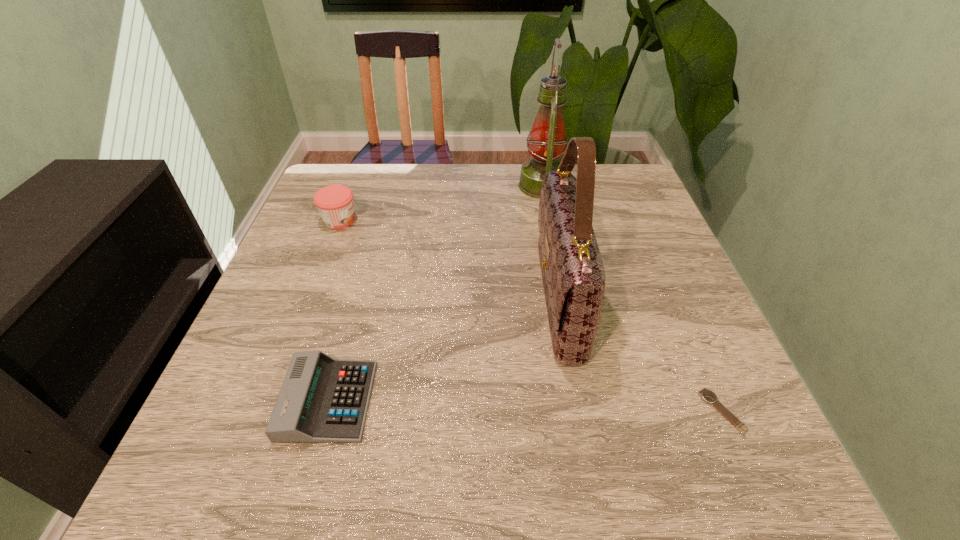
The image size is (960, 540). I want to click on object that is at the far left corner, so click(335, 204).

Locate an element on the screen. This screenshot has width=960, height=540. object present at the near left corner is located at coordinates (322, 400).

Identify the location of vacant space at the far edge of the desktop. This screenshot has height=540, width=960. (502, 169).

The image size is (960, 540). I want to click on vacant area at the left edge of the desktop, so click(x=349, y=259).

The width and height of the screenshot is (960, 540). In the image, there is a desktop. Identify the location of vacant space at the right edge. (628, 244).

I want to click on free space at the far left corner of the desktop, so click(x=357, y=180).

I want to click on vacant space at the far right corner, so click(x=614, y=171).

Find the location of a particular element. The image size is (960, 540). free spot between the rightmost object and the jam is located at coordinates (531, 315).

Find the location of a particular element. Image resolution: width=960 pixels, height=540 pixels. vacant area between the farthest object and the rightmost object is located at coordinates (633, 299).

Find the location of a particular element. vacant space that is in between the rightmost object and the fourth nearest object is located at coordinates (531, 315).